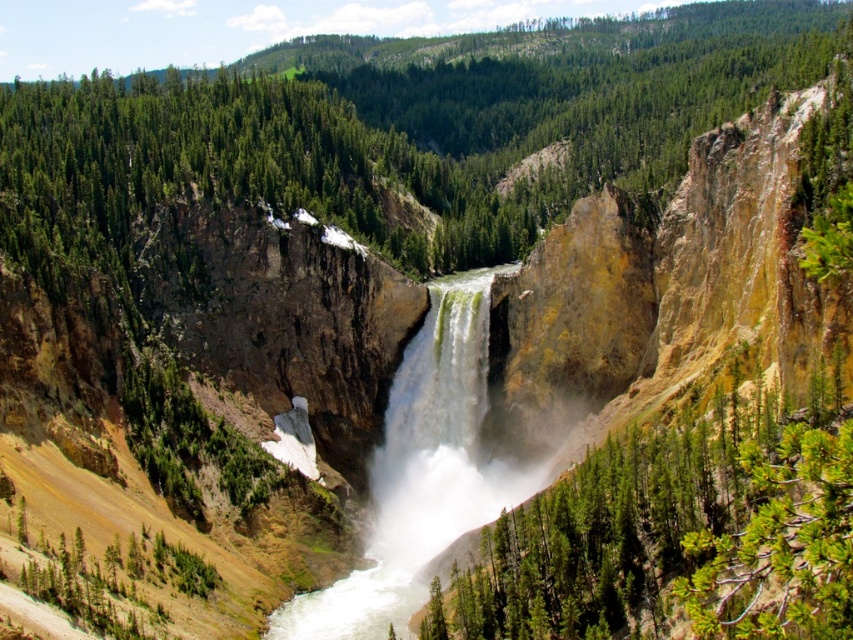
Question: Considering the relative positions of green leafy tree at center and white frothy water at center in the image provided, where is green leafy tree at center located with respect to white frothy water at center?

Choices:
 (A) below
 (B) above

Answer: (B)

Question: Which object is farther from the camera taking this photo?

Choices:
 (A) white frothy water at center
 (B) green leafy tree at center

Answer: (A)

Question: Is green leafy tree at center to the left of white frothy water at center from the viewer's perspective?

Choices:
 (A) no
 (B) yes

Answer: (A)

Question: Observing the image, what is the correct spatial positioning of green leafy tree at center in reference to white frothy water at center?

Choices:
 (A) below
 (B) above

Answer: (B)

Question: Which object is farther from the camera taking this photo?

Choices:
 (A) white frothy water at center
 (B) green leafy tree at center

Answer: (A)